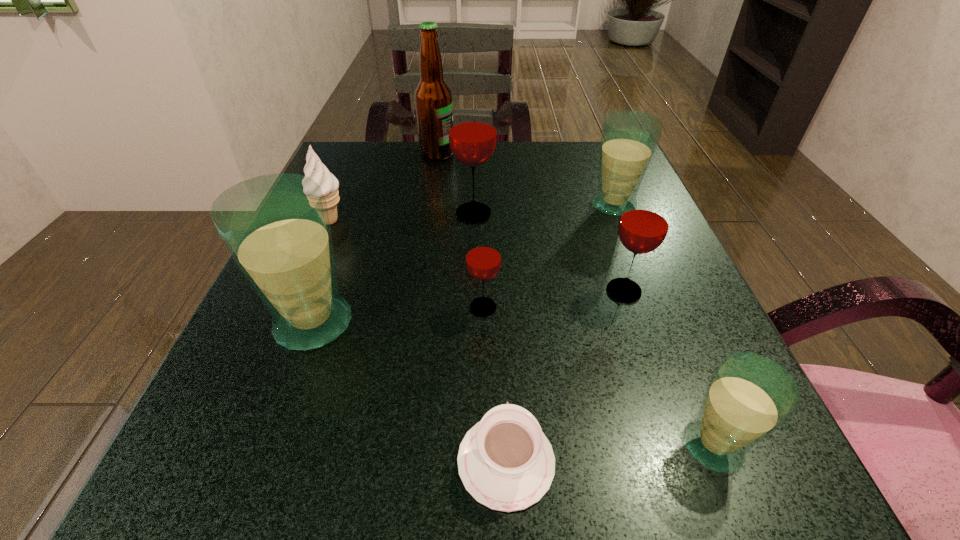
At what (x,y) coordinates should I click in order to perform the action: click on vacant space in between the nearest blue glass and the rightmost red glass. Please return your answer as a coordinate pair (x, y). Looking at the image, I should click on (668, 368).

Image resolution: width=960 pixels, height=540 pixels. Identify the location of vacant space that's between the teacup and the second farthest blue glass. (410, 392).

You are a GUI agent. You are given a task and a screenshot of the screen. Output one action in this format:
    pyautogui.click(x=<x>, y=<y>)
    Task: Click on the unoccupied position between the smallest red glass and the rightmost red glass
    The image size is (960, 540).
    Given the screenshot: What is the action you would take?
    pyautogui.click(x=554, y=299)

I want to click on free space that is in between the farthest blue glass and the third object from left to right, so click(x=525, y=180).

Locate an element on the screen. This screenshot has height=540, width=960. vacant area between the nearest glass and the farthest blue glass is located at coordinates (663, 325).

This screenshot has width=960, height=540. I want to click on free point between the beer bottle and the biggest blue glass, so click(x=375, y=239).

In order to click on object that ranks as the eighth closest to the second biggest red glass in this screenshot , I will do `click(314, 168)`.

The width and height of the screenshot is (960, 540). Identify the location of object that is the sixth closest to the brown beer bottle. (644, 223).

The width and height of the screenshot is (960, 540). What are the coordinates of `glass that stands as the fourth closest to the teacup` in the screenshot? It's located at (644, 223).

Point out which glass is positioned as the fourth nearest to the farthest red glass. Please provide its 2D coordinates. Your answer should be formatted as a tuple, i.e. [(x, y)], where the tuple contains the x and y coordinates of a point satisfying the conditions above.

[(276, 227)]